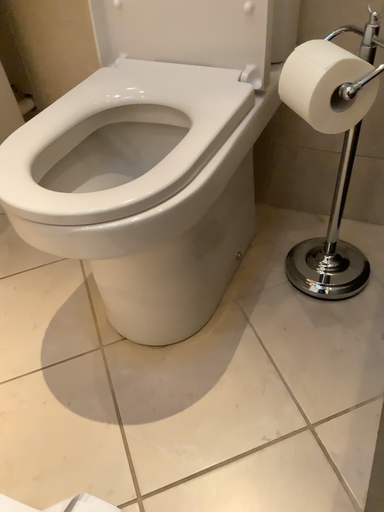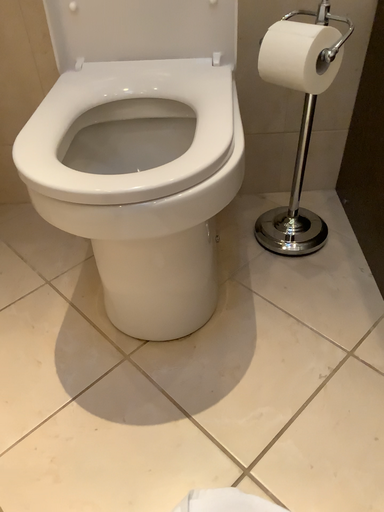
Question: Which way did the camera rotate in the video?

Choices:
 (A) rotated downward
 (B) rotated upward

Answer: (B)